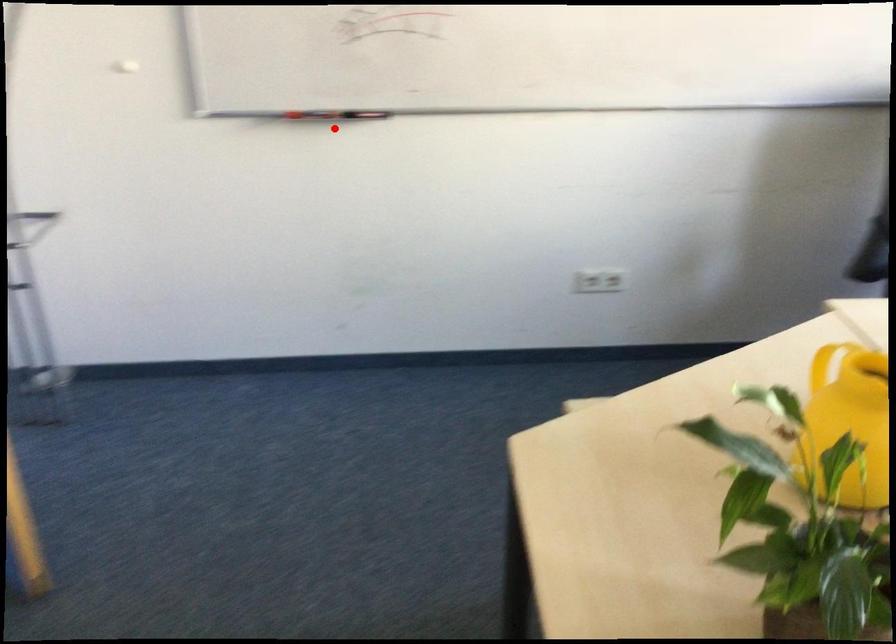
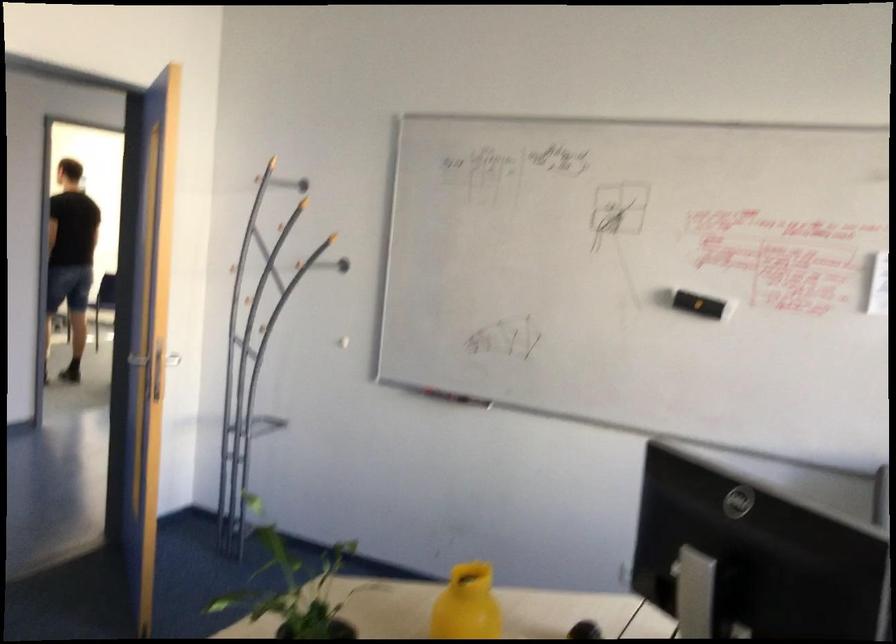
The point at the highlighted location is marked in the first image. Where is the corresponding point in the second image?

(452, 397)